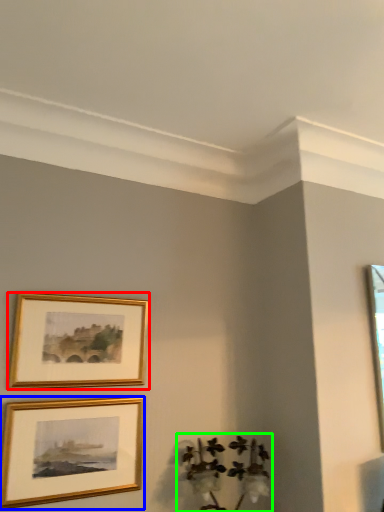
Question: Estimate the real-world distances between objects in this image. Which object is closer to picture frame (highlighted by a red box), picture frame (highlighted by a blue box) or plant (highlighted by a green box)?

Choices:
 (A) picture frame
 (B) plant

Answer: (A)